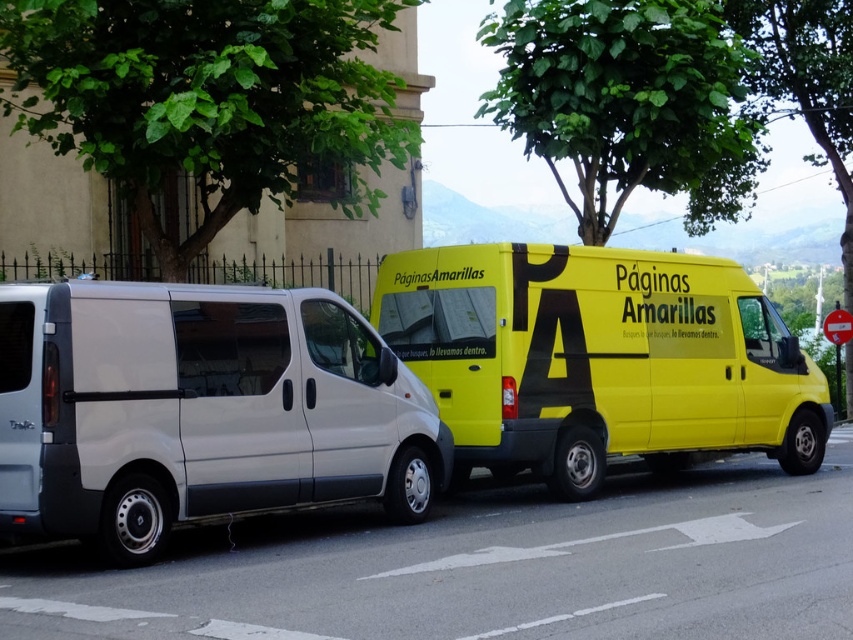
Question: Is matte white van at left positioned before yellow matte van at center?

Choices:
 (A) yes
 (B) no

Answer: (A)

Question: Is matte white van at left smaller than yellow matte van at center?

Choices:
 (A) yes
 (B) no

Answer: (B)

Question: Which object appears closest to the camera in this image?

Choices:
 (A) yellow matte van at center
 (B) matte white van at left

Answer: (B)

Question: Which point is farther to the camera?

Choices:
 (A) yellow matte van at center
 (B) matte white van at left

Answer: (A)

Question: Does matte white van at left appear on the right side of yellow matte van at center?

Choices:
 (A) no
 (B) yes

Answer: (A)